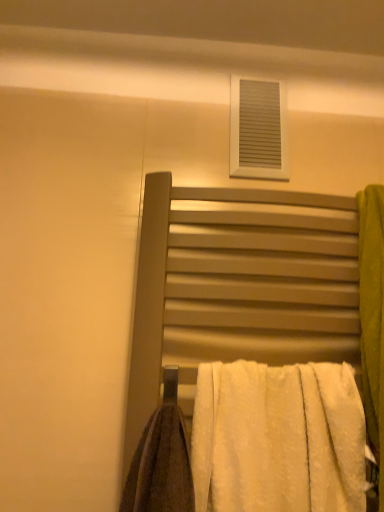
Question: Does white fluffy towel at center have a larger size compared to white matte vent at upper center?

Choices:
 (A) yes
 (B) no

Answer: (A)

Question: Considering the relative sizes of white fluffy towel at center and white matte vent at upper center in the image provided, is white fluffy towel at center thinner than white matte vent at upper center?

Choices:
 (A) no
 (B) yes

Answer: (A)

Question: Are white fluffy towel at center and white matte vent at upper center beside each other?

Choices:
 (A) no
 (B) yes

Answer: (A)

Question: Could white matte vent at upper center be considered to be inside white fluffy towel at center?

Choices:
 (A) no
 (B) yes

Answer: (A)

Question: Is white fluffy towel at center wider than white matte vent at upper center?

Choices:
 (A) yes
 (B) no

Answer: (A)

Question: Is point (273, 92) positioned closer to the camera than point (228, 232)?

Choices:
 (A) farther
 (B) closer

Answer: (A)

Question: Is white matte vent at upper center to the left or to the right of matte metal towel rack at center in the image?

Choices:
 (A) left
 (B) right

Answer: (B)

Question: Considering the positions of white matte vent at upper center and matte metal towel rack at center in the image, is white matte vent at upper center bigger or smaller than matte metal towel rack at center?

Choices:
 (A) big
 (B) small

Answer: (B)

Question: Is white matte vent at upper center inside the boundaries of matte metal towel rack at center, or outside?

Choices:
 (A) inside
 (B) outside

Answer: (B)

Question: Does point (135, 331) appear closer or farther from the camera than point (233, 387)?

Choices:
 (A) farther
 (B) closer

Answer: (A)

Question: Is matte metal towel rack at center wider or thinner than white fluffy towel at center?

Choices:
 (A) thin
 (B) wide

Answer: (A)

Question: Would you say matte metal towel rack at center is inside or outside white fluffy towel at center?

Choices:
 (A) inside
 (B) outside

Answer: (B)

Question: In terms of height, does matte metal towel rack at center look taller or shorter compared to white fluffy towel at center?

Choices:
 (A) short
 (B) tall

Answer: (B)

Question: Does point (263, 420) appear closer or farther from the camera than point (271, 101)?

Choices:
 (A) closer
 (B) farther

Answer: (A)

Question: In terms of height, does white fluffy towel at center look taller or shorter compared to white matte vent at upper center?

Choices:
 (A) short
 (B) tall

Answer: (B)